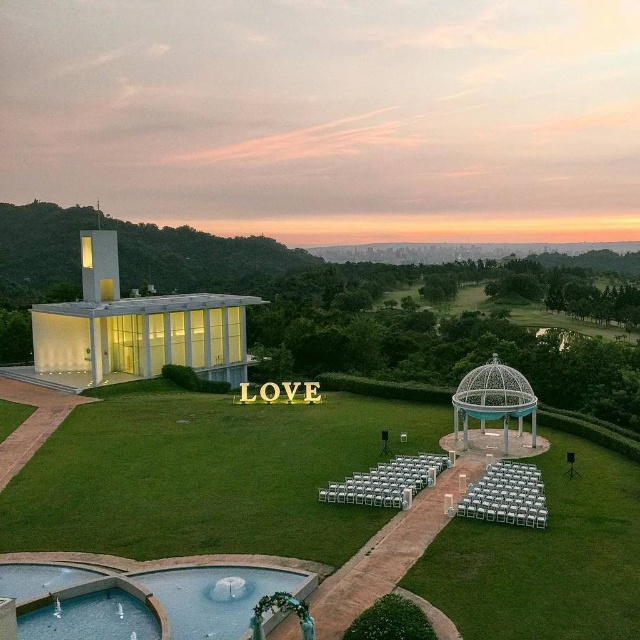
Which is more to the left, green grassy hillside at upper left or white metal gazebo at center?

Positioned to the left is green grassy hillside at upper left.

Can you confirm if green grassy hillside at upper left is positioned above white metal gazebo at center?

Correct, green grassy hillside at upper left is located above white metal gazebo at center.

Is point (289, 262) in front of point (500, 397)?

No, it is behind (500, 397).

Identify the location of green grassy hillside at upper left. This screenshot has height=640, width=640. (202, 259).

Between point (84, 500) and point (160, 324), which one is positioned in front?

Point (84, 500)

Is green grass lawn at center closer to camera compared to matte glass gazebo at center?

Yes, it is.

The height and width of the screenshot is (640, 640). What are the coordinates of `green grass lawn at center` in the screenshot? It's located at (205, 476).

Who is lower down, green grass lawn at center or clear glass water at lower center?

clear glass water at lower center is lower down.

Based on the photo, can you confirm if green grass lawn at center is positioned below clear glass water at lower center?

Incorrect, green grass lawn at center is not positioned below clear glass water at lower center.

Does point (429, 429) come farther from viewer compared to point (176, 604)?

Yes, it is behind point (176, 604).

This screenshot has width=640, height=640. I want to click on green grass lawn at center, so click(x=205, y=476).